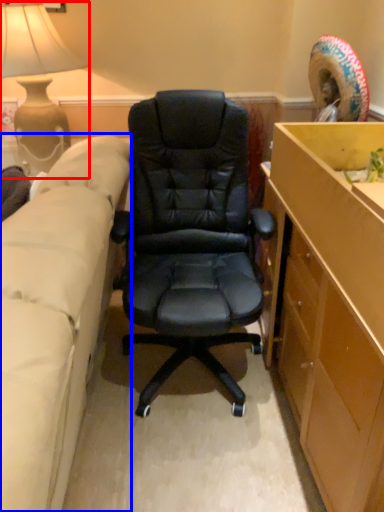
Question: Among these objects, which one is nearest to the camera, lamp (highlighted by a red box) or studio couch (highlighted by a blue box)?

Choices:
 (A) lamp
 (B) studio couch

Answer: (B)